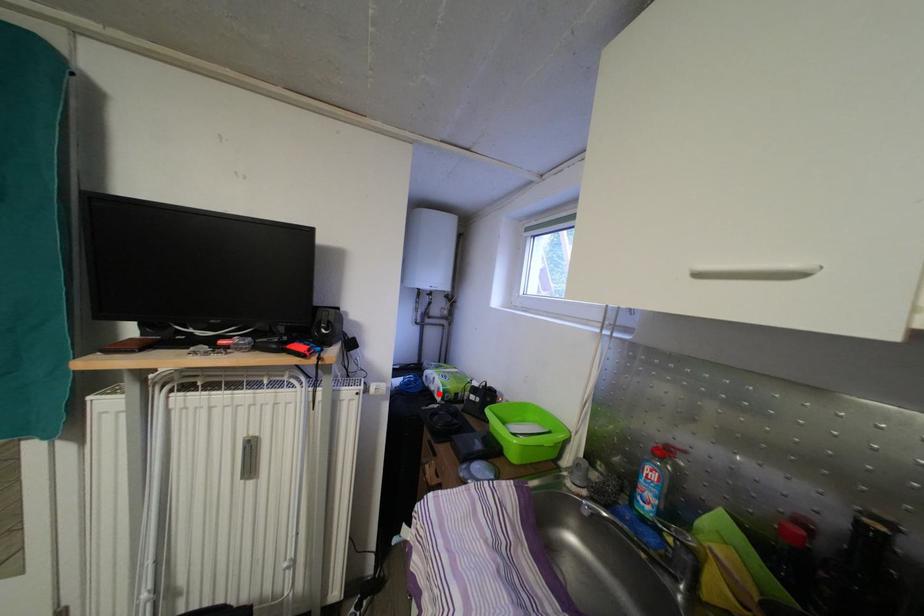
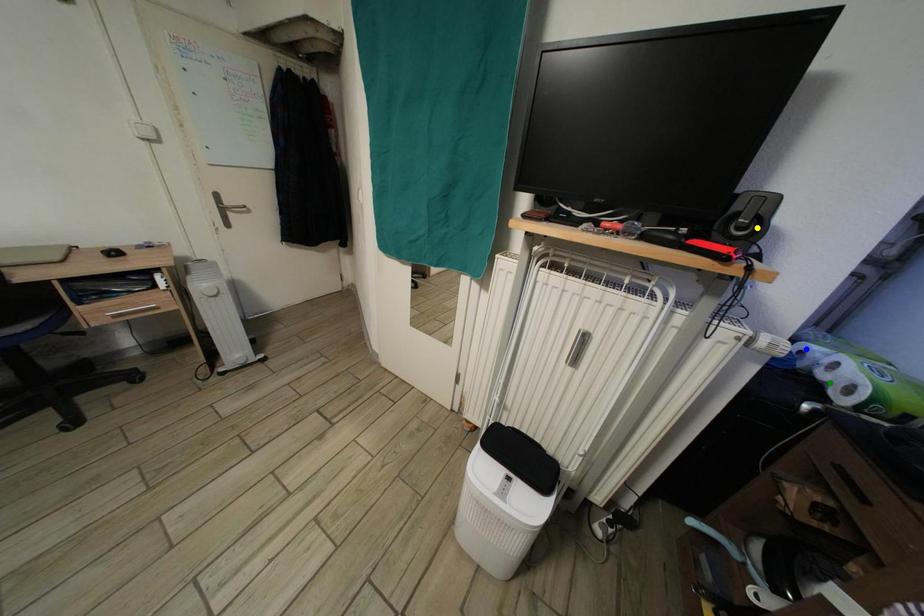
Question: I am providing you with two images of the same scene from different viewpoints. A red point is marked on the first image. You are given multiple points on the second image. Which mark in image 2 goes with the point in image 1?

Choices:
 (A) yellow point
 (B) blue point
 (C) green point

Answer: (C)